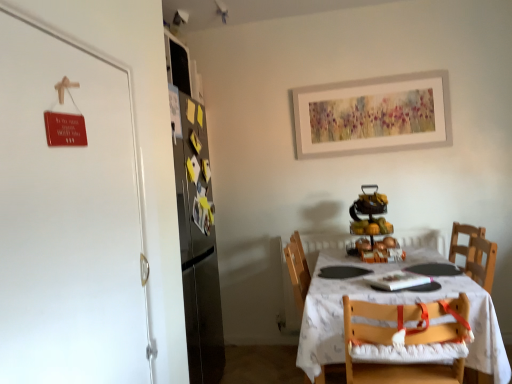
Question: From the image's perspective, is shiny metallic fruit stand at center positioned above or below metallic refrigerator at upper left?

Choices:
 (A) below
 (B) above

Answer: (A)

Question: Considering the positions of point (382, 228) and point (184, 89), is point (382, 228) closer or farther from the camera than point (184, 89)?

Choices:
 (A) closer
 (B) farther

Answer: (A)

Question: Estimate the real-world distances between objects in this image. Which object is closer to the metallic refrigerator at upper left?

Choices:
 (A) wooden chair with white cushion at lower right
 (B) white matte door at left
 (C) white cloth-covered table at center
 (D) shiny metallic fruit stand at center

Answer: (D)

Question: Which object is positioned closest to the wooden chair with white cushion at lower right?

Choices:
 (A) white matte door at left
 (B) white cloth-covered table at center
 (C) metallic refrigerator at upper left
 (D) shiny metallic fruit stand at center

Answer: (B)